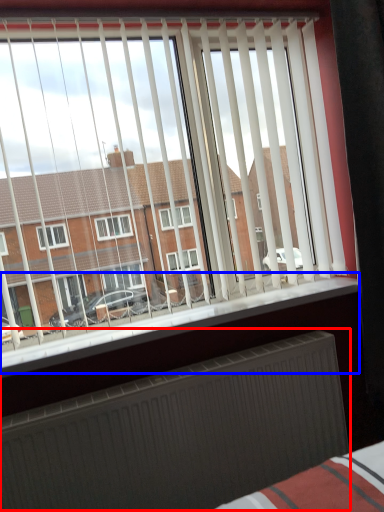
Question: Which object appears closest to the camera in this image, radiator (highlighted by a red box) or window sill (highlighted by a blue box)?

Choices:
 (A) radiator
 (B) window sill

Answer: (A)